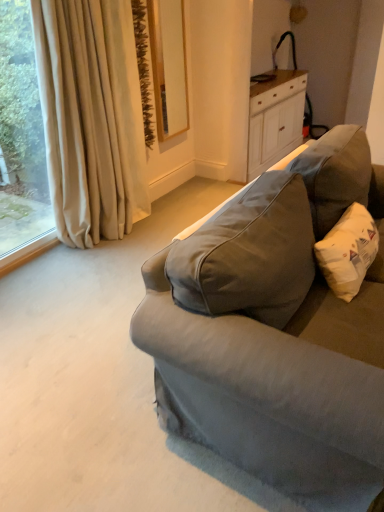
Question: Is white cotton pillow at right oriented towards white wood cabinet at upper right?

Choices:
 (A) yes
 (B) no

Answer: (B)

Question: Is the depth of white cotton pillow at right greater than that of white wood cabinet at upper right?

Choices:
 (A) yes
 (B) no

Answer: (B)

Question: Considering the relative positions of white cotton pillow at right and white wood cabinet at upper right in the image provided, is white cotton pillow at right to the right of white wood cabinet at upper right from the viewer's perspective?

Choices:
 (A) yes
 (B) no

Answer: (B)

Question: From the image's perspective, is white cotton pillow at right over white wood cabinet at upper right?

Choices:
 (A) no
 (B) yes

Answer: (A)

Question: Considering the relative sizes of white cotton pillow at right and white wood cabinet at upper right in the image provided, is white cotton pillow at right bigger than white wood cabinet at upper right?

Choices:
 (A) yes
 (B) no

Answer: (B)

Question: From a real-world perspective, is beige curtain at left positioned above or below white wood cabinet at upper right?

Choices:
 (A) below
 (B) above

Answer: (B)

Question: Looking at their shapes, would you say beige curtain at left is wider or thinner than white wood cabinet at upper right?

Choices:
 (A) thin
 (B) wide

Answer: (A)

Question: From the image's perspective, is beige curtain at left located above or below white wood cabinet at upper right?

Choices:
 (A) above
 (B) below

Answer: (B)

Question: Relative to white wood cabinet at upper right, is beige curtain at left in front or behind?

Choices:
 (A) behind
 (B) front

Answer: (B)

Question: Is matte gray fabric couch at right inside the boundaries of white wood cabinet at upper right, or outside?

Choices:
 (A) inside
 (B) outside

Answer: (B)

Question: Relative to white wood cabinet at upper right, is matte gray fabric couch at right in front or behind?

Choices:
 (A) front
 (B) behind

Answer: (A)

Question: Considering the positions of matte gray fabric couch at right and white wood cabinet at upper right in the image, is matte gray fabric couch at right bigger or smaller than white wood cabinet at upper right?

Choices:
 (A) big
 (B) small

Answer: (A)

Question: Would you say matte gray fabric couch at right is to the left or to the right of white wood cabinet at upper right in the picture?

Choices:
 (A) right
 (B) left

Answer: (B)

Question: Would you say beige curtain at left is inside or outside white cotton pillow at right?

Choices:
 (A) outside
 (B) inside

Answer: (A)

Question: In terms of width, does beige curtain at left look wider or thinner when compared to white cotton pillow at right?

Choices:
 (A) wide
 (B) thin

Answer: (B)